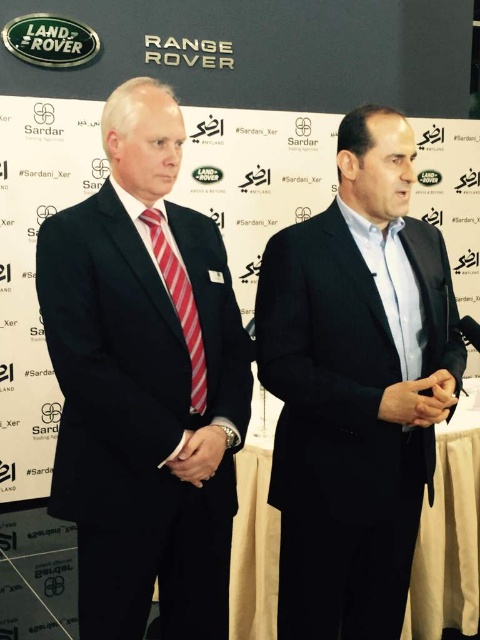
You are a photographer at a Land Rover event. You need to ensure both the black matte suit at left and the red striped tie at center are clearly visible in your photo. Given their sizes, which object should you focus on first to ensure it doesn

The black matte suit at left is much taller than the red striped tie at center, so you should focus on the black matte suit at left first to ensure it is in clear focus before adjusting for the smaller red striped tie at center.

You are attending a formal event and want to know if the black matte suit at center is longer than the red striped tie at center. Can you confirm?

The black matte suit at center is taller than the red striped tie at center, so yes, the black matte suit at center is longer than the red striped tie at center.